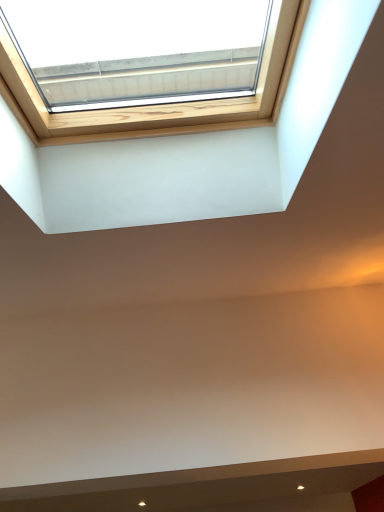
This screenshot has width=384, height=512. Describe the element at coordinates (165, 103) in the screenshot. I see `wooden frame at upper center` at that location.

What are the coordinates of `wooden frame at upper center` in the screenshot? It's located at (165, 103).

Find the location of a particular element. This screenshot has height=512, width=384. wooden frame at upper center is located at coordinates (165, 103).